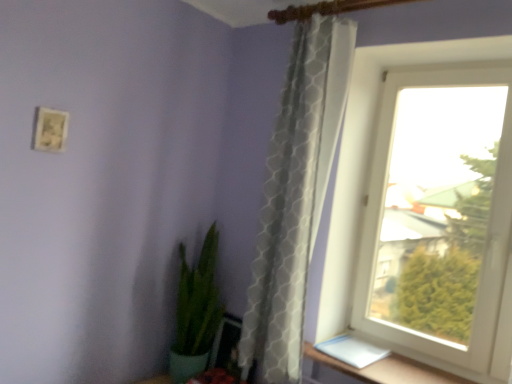
Question: From a real-world perspective, is green glossy plant at lower left physically located above or below matte white picture frame at upper left?

Choices:
 (A) below
 (B) above

Answer: (A)

Question: Choose the correct answer: Is green glossy plant at lower left inside matte white picture frame at upper left or outside it?

Choices:
 (A) outside
 (B) inside

Answer: (A)

Question: Which object is the closest to the brown wooden window sill at lower right?

Choices:
 (A) matte white picture frame at upper left
 (B) green glossy plant at lower left
 (C) white textured curtain at right
 (D) white plastic window at upper right

Answer: (D)

Question: Which object is the farthest from the matte white picture frame at upper left?

Choices:
 (A) white plastic window at upper right
 (B) brown wooden window sill at lower right
 (C) green glossy plant at lower left
 (D) white textured curtain at right

Answer: (A)